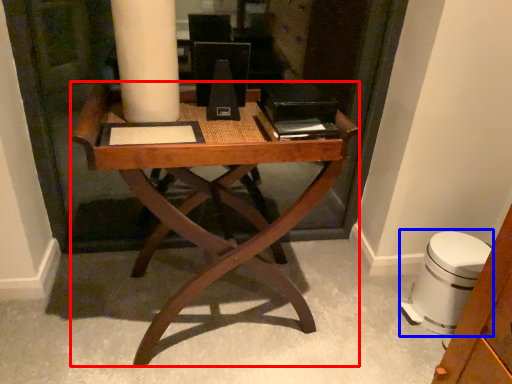
Question: Among these objects, which one is farthest to the camera, desk (highlighted by a red box) or swivel chair (highlighted by a blue box)?

Choices:
 (A) desk
 (B) swivel chair

Answer: (B)